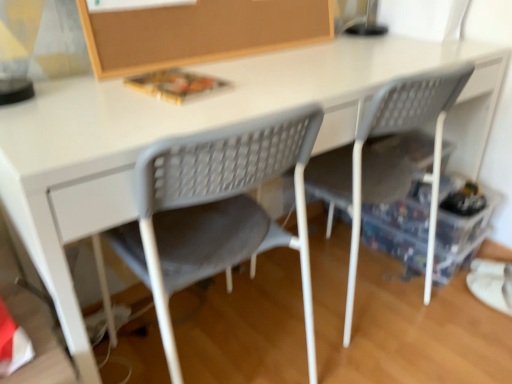
Locate an element on the screen. vacant space underneath gray plastic chair at center, the second chair positioned from the left (from a real-world perspective) is located at coordinates (338, 291).